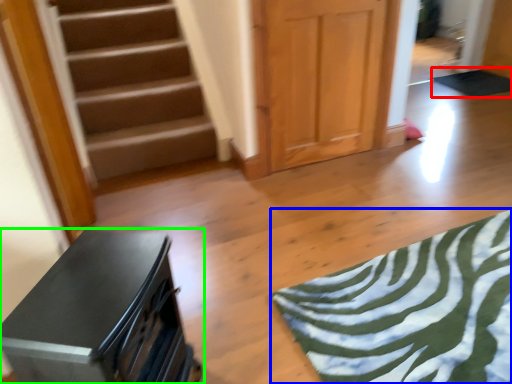
Question: Which is nearer to the yoga mat (highlighted by a red box)? yoga mat (highlighted by a blue box) or furniture (highlighted by a green box).

Choices:
 (A) yoga mat
 (B) furniture

Answer: (A)